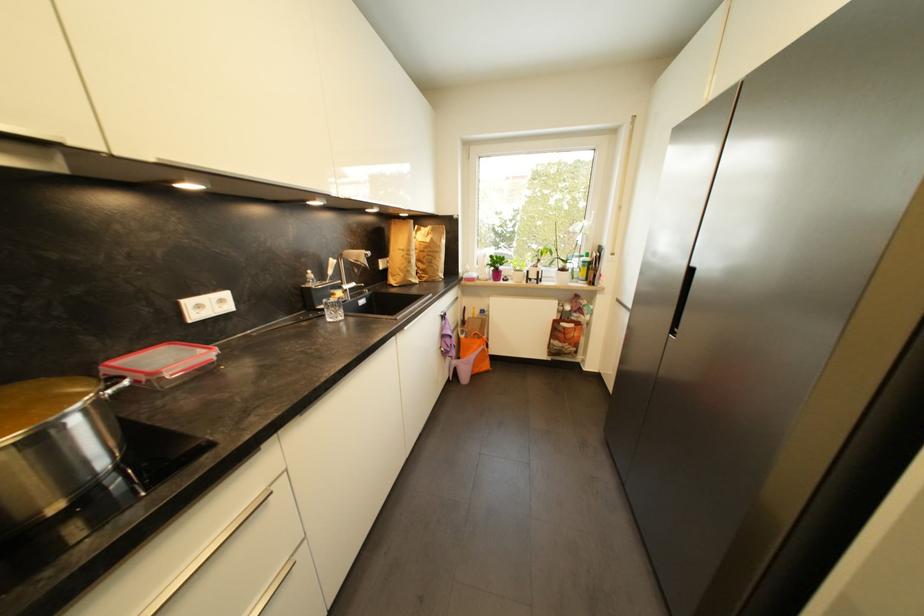
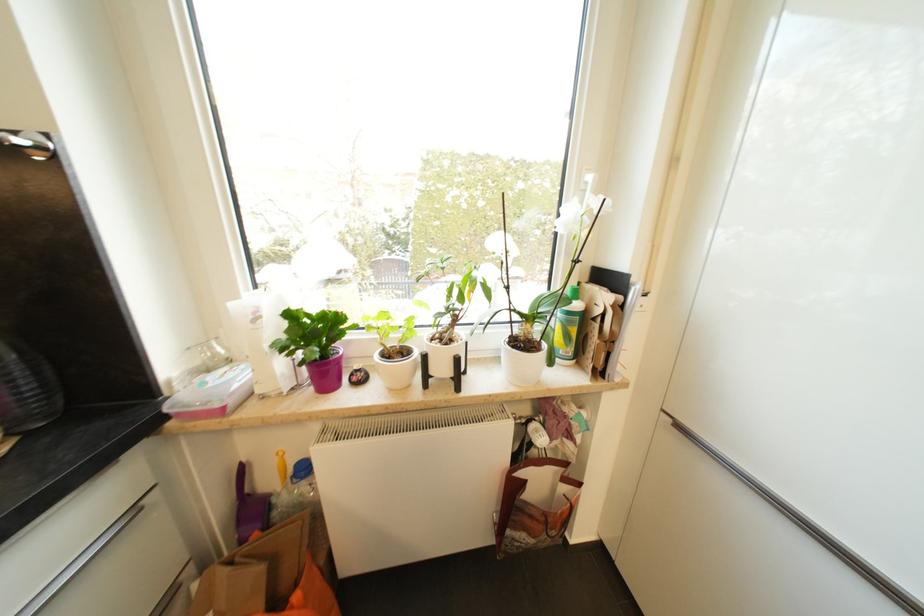
Locate, in the second image, the point that corresponds to [482,314] in the first image.

(295, 471)